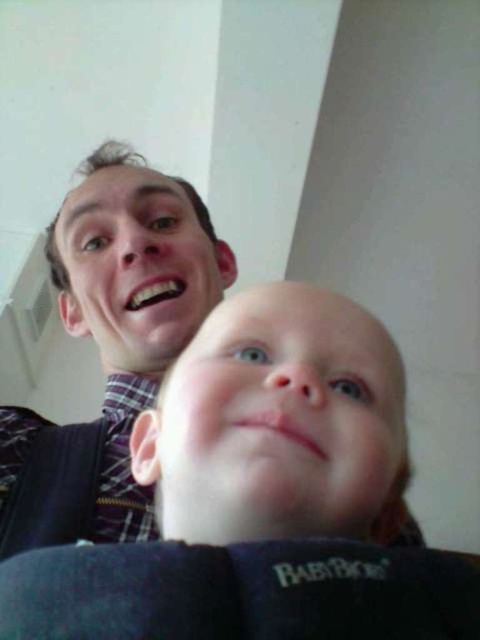
Question: Which point is farther to the camera?

Choices:
 (A) matte plaid shirt at upper left
 (B) smooth skin baby at center

Answer: (A)

Question: Which point appears closest to the camera in this image?

Choices:
 (A) (122, 493)
 (B) (273, 388)

Answer: (B)

Question: Is smooth skin baby at center wider than matte plaid shirt at upper left?

Choices:
 (A) yes
 (B) no

Answer: (B)

Question: In this image, where is smooth skin baby at center located relative to matte plaid shirt at upper left?

Choices:
 (A) above
 (B) below

Answer: (B)

Question: Is smooth skin baby at center bigger than matte plaid shirt at upper left?

Choices:
 (A) yes
 (B) no

Answer: (B)